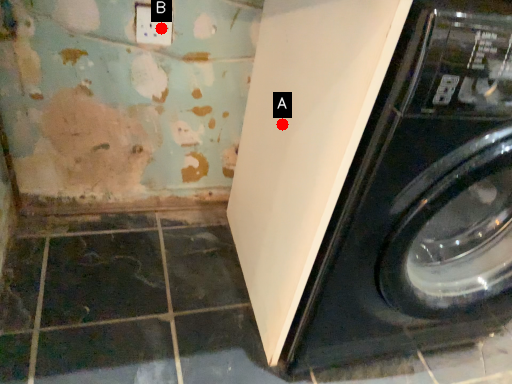
Question: Two points are circled on the image, labeled by A and B beside each circle. Which point appears farthest from the camera in this image?

Choices:
 (A) A is further
 (B) B is further

Answer: (B)